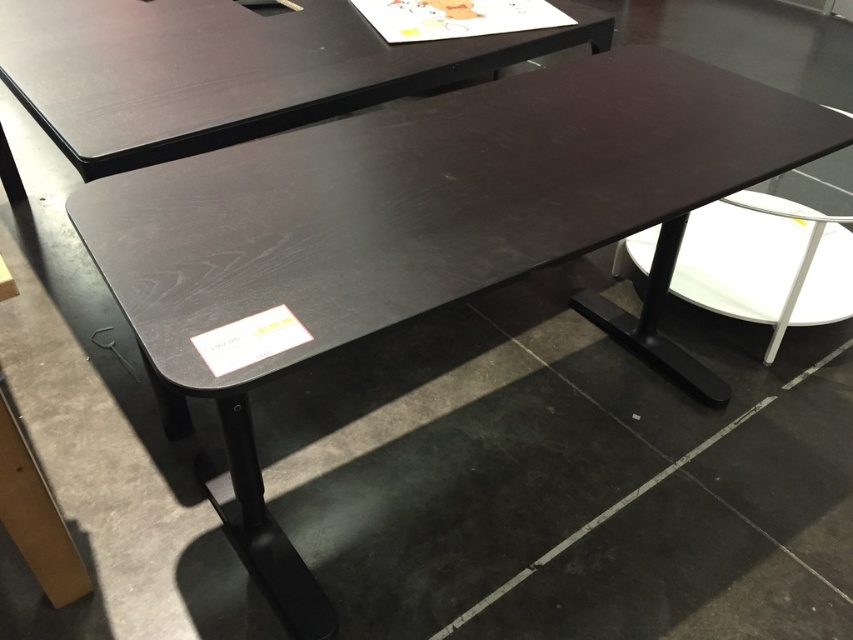
Question: Which point appears closest to the camera in this image?

Choices:
 (A) (4, 19)
 (B) (849, 268)

Answer: (A)

Question: Which of the following is the farthest from the observer?

Choices:
 (A) matte black table at upper center
 (B) white glossy stool at center

Answer: (B)

Question: Which of the following is the farthest from the observer?

Choices:
 (A) (798, 307)
 (B) (318, 90)

Answer: (A)

Question: Is matte black table at upper center above white glossy stool at center?

Choices:
 (A) yes
 (B) no

Answer: (A)

Question: Where is matte black table at upper center located in relation to white glossy stool at center in the image?

Choices:
 (A) above
 (B) below

Answer: (A)

Question: Can you confirm if matte black table at upper center is positioned above white glossy stool at center?

Choices:
 (A) yes
 (B) no

Answer: (A)